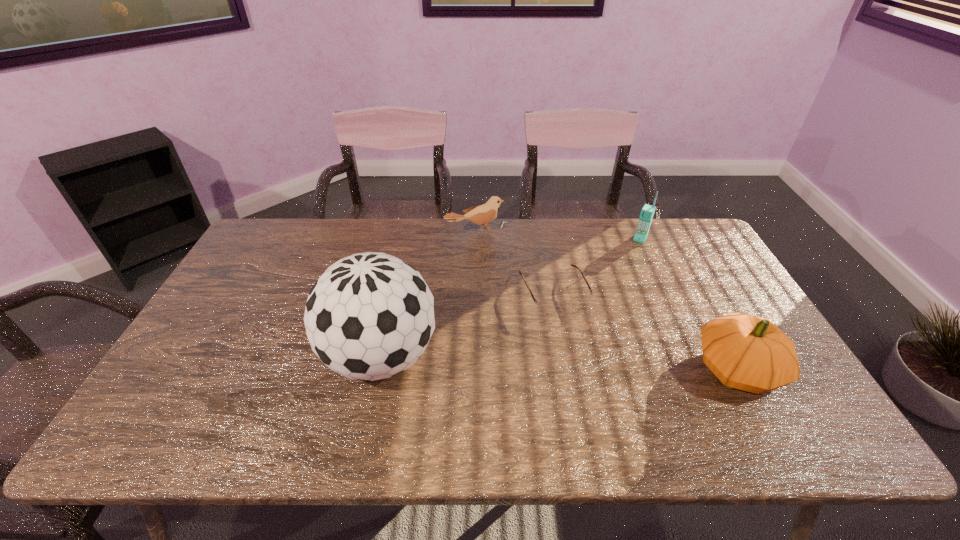
Locate an element on the screen. The image size is (960, 540). object that is at the right edge is located at coordinates tap(749, 353).

Find the location of a particular element. The width and height of the screenshot is (960, 540). object that is at the near right corner is located at coordinates (749, 353).

In order to click on free point at the far edge in this screenshot , I will do `click(618, 255)`.

In the image, there is a desktop. Identify the location of vacant space at the near edge. (608, 406).

This screenshot has height=540, width=960. In the image, there is a desktop. Identify the location of vacant space at the left edge. (229, 298).

Locate an element on the screen. This screenshot has height=540, width=960. vacant area at the far left corner is located at coordinates (277, 242).

Where is `free space at the far right corner of the desktop`? This screenshot has height=540, width=960. free space at the far right corner of the desktop is located at coordinates (680, 227).

Where is `unoccupied position between the third object from right to left and the cellular telephone`? unoccupied position between the third object from right to left and the cellular telephone is located at coordinates (597, 266).

The height and width of the screenshot is (540, 960). Find the location of `free space between the gourd and the second shortest object`. free space between the gourd and the second shortest object is located at coordinates (607, 300).

Find the location of a particular element. This screenshot has width=960, height=540. unoccupied position between the spectacles and the gourd is located at coordinates (645, 330).